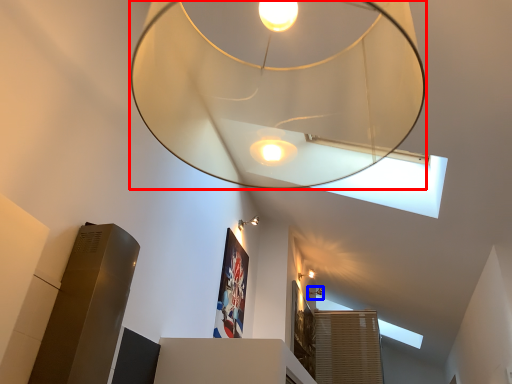
Question: Which of the following is the farthest to the observer, lamp (highlighted by a red box) or lamp (highlighted by a blue box)?

Choices:
 (A) lamp
 (B) lamp

Answer: (B)